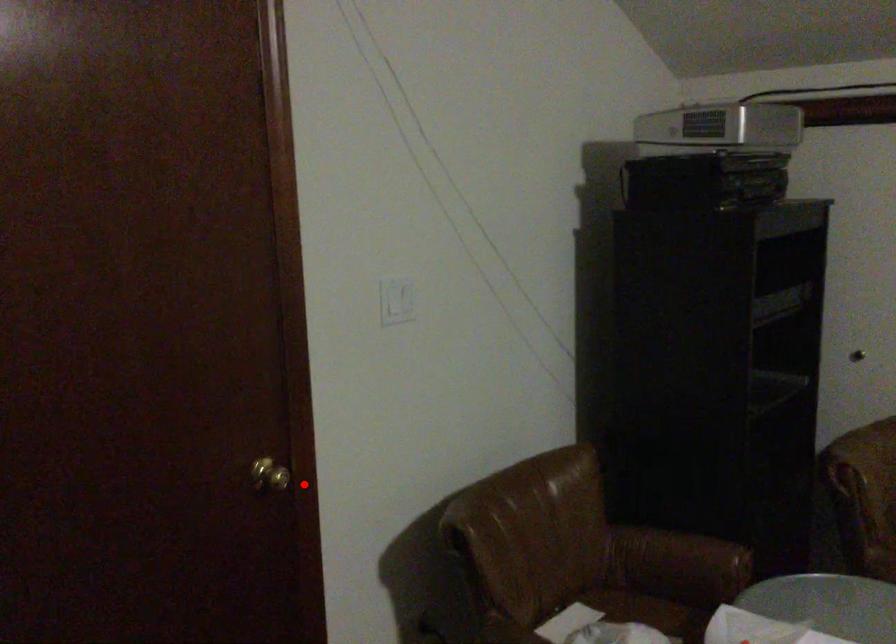
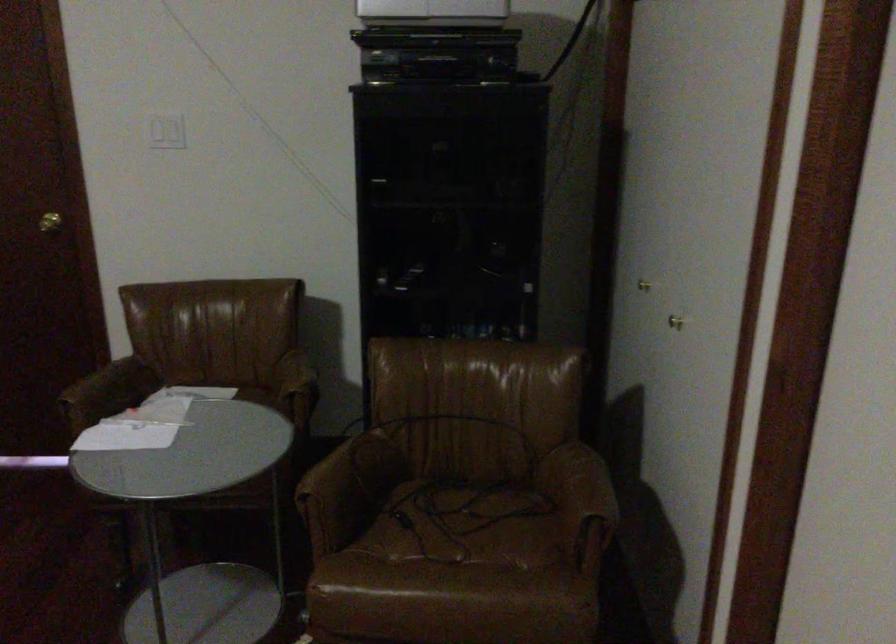
In the second image, find the point that corresponds to the highlighted location in the first image.

(49, 222)